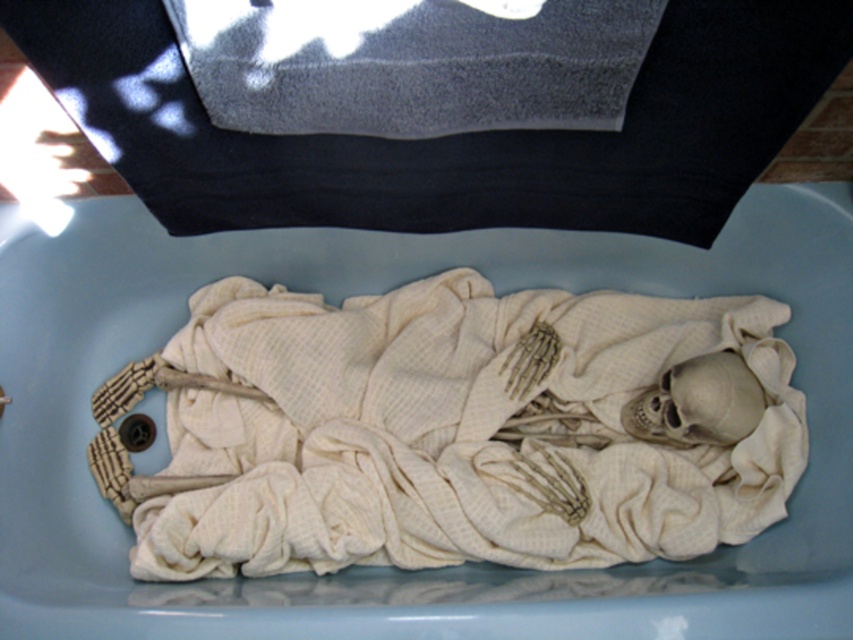
You are an archaeologist examining the image of a skeleton in a container. You notice a specific point marked at coordinates (387, 566). What object is located at that point?

The point at coordinates (387, 566) corresponds to the white fabric covered skeleton at center.